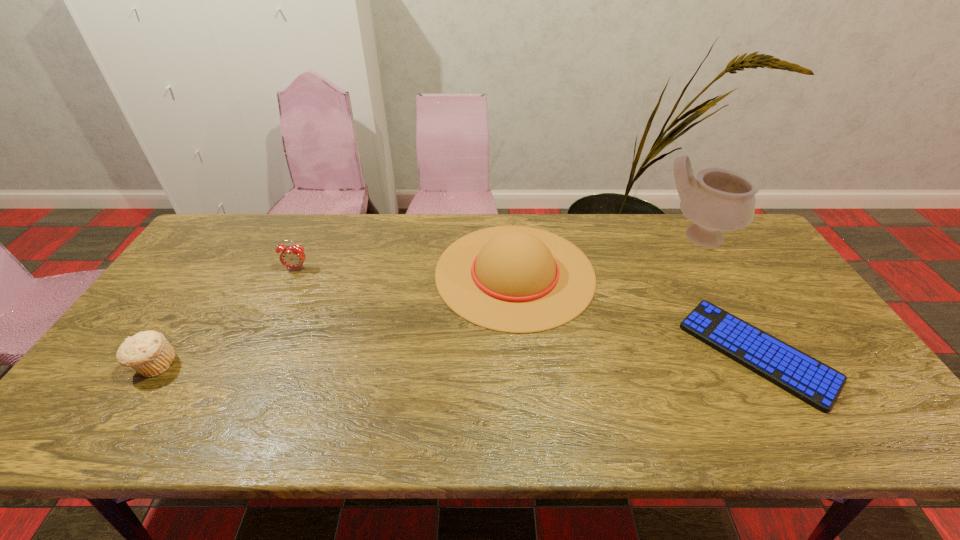
The height and width of the screenshot is (540, 960). Find the location of `pottery positioned at the far edge`. pottery positioned at the far edge is located at coordinates (718, 200).

Where is `sombrero at the far edge`? sombrero at the far edge is located at coordinates (514, 279).

Locate an element on the screen. object present at the near edge is located at coordinates (817, 384).

I want to click on object present at the left edge, so click(149, 353).

Locate an element on the screen. Image resolution: width=960 pixels, height=540 pixels. pottery situated at the right edge is located at coordinates (718, 200).

This screenshot has height=540, width=960. In order to click on computer keyboard situated at the right edge in this screenshot , I will do `click(817, 384)`.

The image size is (960, 540). I want to click on object situated at the far right corner, so click(x=718, y=200).

The width and height of the screenshot is (960, 540). What are the coordinates of `object that is at the near right corner` in the screenshot? It's located at (817, 384).

Locate an element on the screen. This screenshot has height=540, width=960. free space at the far edge is located at coordinates (552, 227).

The height and width of the screenshot is (540, 960). What are the coordinates of `blank space at the near edge` in the screenshot? It's located at (201, 440).